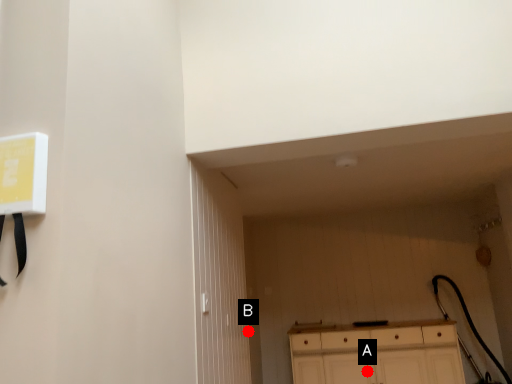
Question: Two points are circled on the image, labeled by A and B beside each circle. Which point is further to the camera?

Choices:
 (A) A is further
 (B) B is further

Answer: (B)